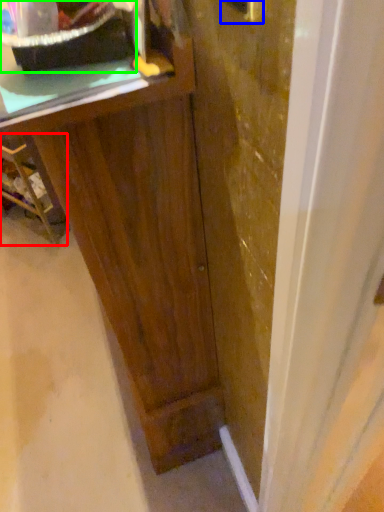
Question: Estimate the real-world distances between objects in this image. Which object is farther from furniture (highlighted by a red box), door handle (highlighted by a blue box) or appliance (highlighted by a green box)?

Choices:
 (A) door handle
 (B) appliance

Answer: (A)